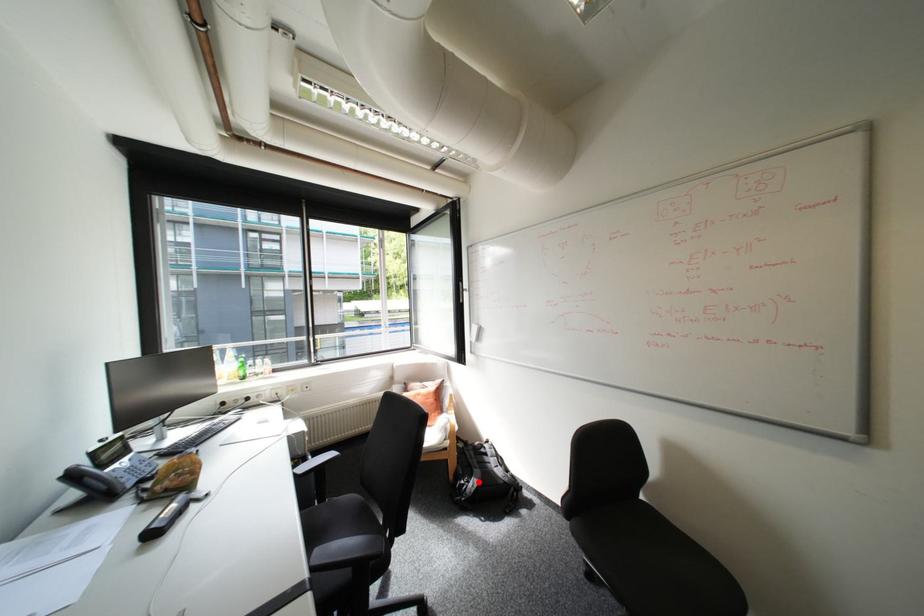
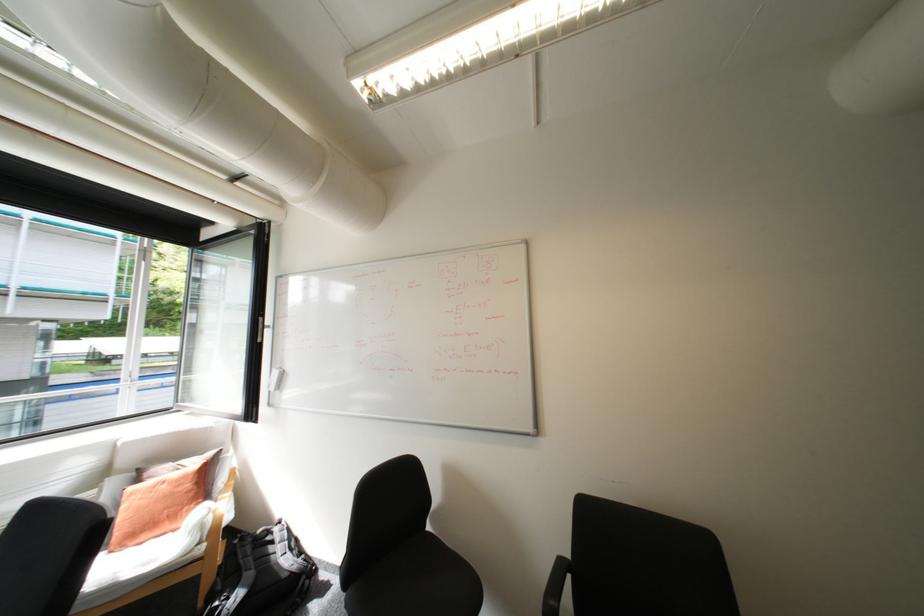
Question: I am providing you with two images of the same scene from different viewpoints. Image1 has a red point marked. In image2, the corresponding 3D location appears at what relative position? Reply with the corresponding letter.

Choices:
 (A) Closer
 (B) Farther

Answer: (A)